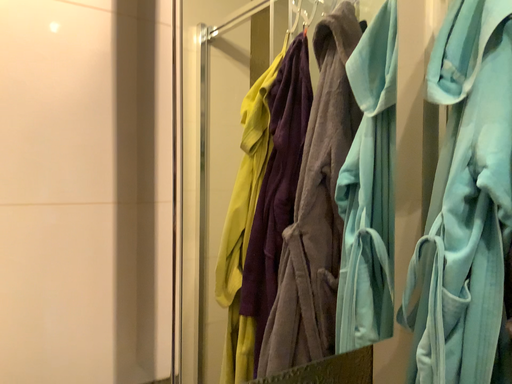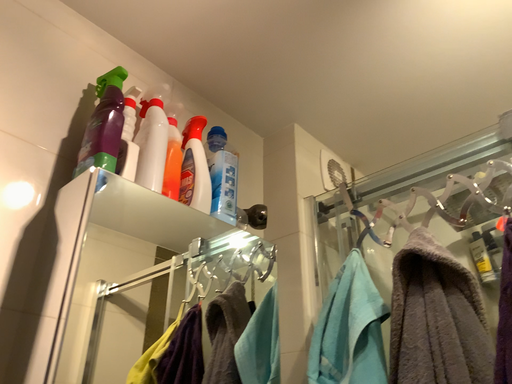
Question: Which way did the camera rotate in the video?

Choices:
 (A) rotated left
 (B) rotated right

Answer: (B)